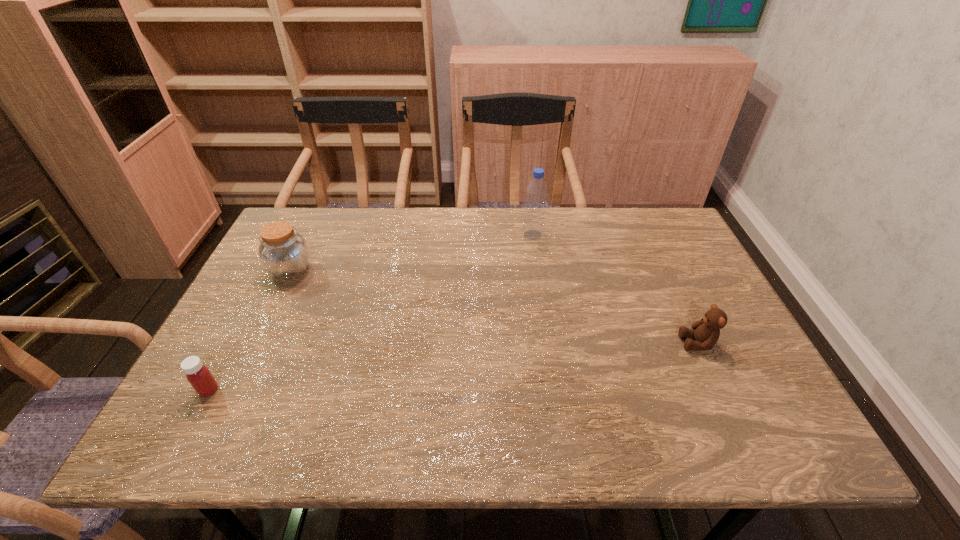
What are the coordinates of `vacant area at the right edge` in the screenshot? It's located at (690, 285).

You are a GUI agent. You are given a task and a screenshot of the screen. Output one action in this format:
    pyautogui.click(x=<x>, y=<y>)
    Task: Click on the free space at the far right corner of the desktop
    Image resolution: width=960 pixels, height=540 pixels.
    Given the screenshot: What is the action you would take?
    pyautogui.click(x=651, y=218)

Locate an element on the screen. Image resolution: width=960 pixels, height=540 pixels. vacant space in between the medicine and the jar is located at coordinates (250, 330).

At what (x,y) coordinates should I click in order to perform the action: click on unoccupied position between the second object from right to left and the teddy bear. Please return your answer as a coordinate pair (x, y). This screenshot has width=960, height=540. Looking at the image, I should click on (615, 289).

This screenshot has height=540, width=960. I want to click on free spot between the teddy bear and the third object from left to right, so click(615, 289).

Locate an element on the screen. free space between the farthest object and the second nearest object is located at coordinates (615, 289).

Find the location of a particular element. empty space between the nearest object and the tallest object is located at coordinates (371, 312).

At what (x,y) coordinates should I click in order to perform the action: click on unoccupied area between the teddy bear and the jar. Please return your answer as a coordinate pair (x, y). The height and width of the screenshot is (540, 960). Looking at the image, I should click on (494, 307).

At what (x,y) coordinates should I click in order to perform the action: click on empty space that is in between the jar and the bottle. Please return your answer as a coordinate pair (x, y). This screenshot has width=960, height=540. Looking at the image, I should click on (412, 253).

Locate an element on the screen. This screenshot has height=540, width=960. vacant area that lies between the bottle and the second tallest object is located at coordinates (412, 253).